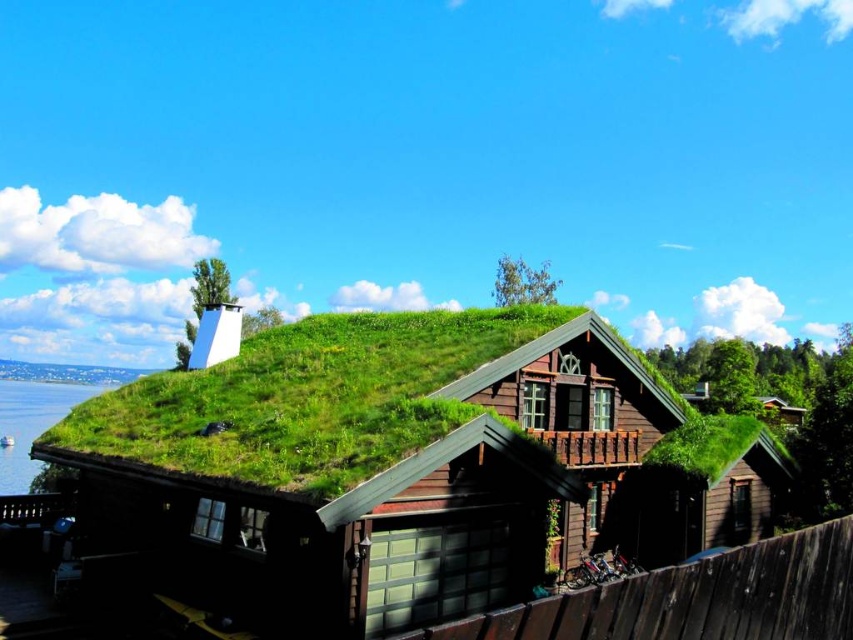
You are planning to build a small garden between the brown wooden cabin at center and the blue water at lower left. Considering their widths, which area would you choose for the garden to ensure it fits comfortably without overcrowding?

Since the brown wooden cabin at center is narrower than the blue water at lower left, you should choose the area near the brown wooden cabin at center for the garden to ensure it fits comfortably without overcrowding.

You are standing on the balcony of the brown wooden cabin at center and want to look down towards the blue water at lower left. In which direction should you turn your head?

You should turn your head to the left because the brown wooden cabin at center is to the right of the blue water at lower left, so looking left from the cabin would face towards the water.